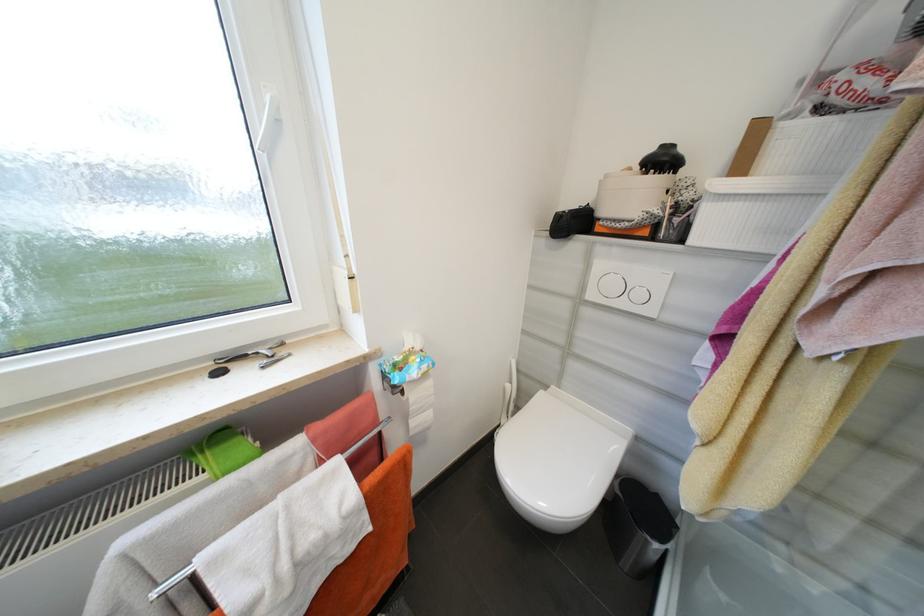
Identify the location of white window handle. (269, 115).